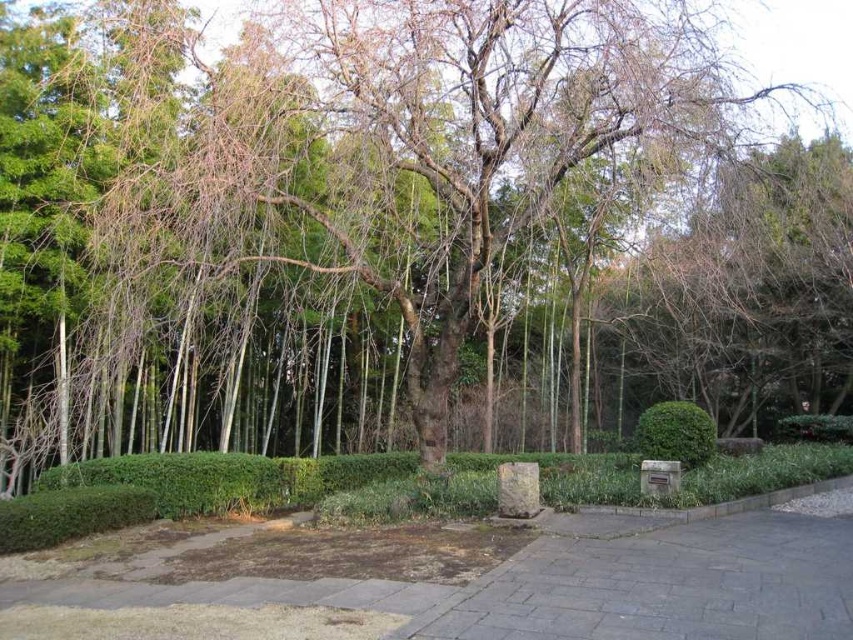
Based on the photo, you are a gardener planning to plant a new flower bed between the gray stone pavement at lower center and the green matte bush at center. Which object is shorter so that the flowers can grow taller than both?

The gray stone pavement at lower center has a lesser height compared to the green matte bush at center, so the flowers should be planted where they can grow taller than both the gray stone pavement at lower center and the green matte bush at center.

You are standing on the gray stone pavement at lower center and want to reach the green matte bush at center. Which direction should you move to get there?

You should move upward to reach the green matte bush at center because the gray stone pavement at lower center is below it.

You are planning to place a small garden statue that requires a 2x2 meter space. You have two options for placement in the scene described. The first option is on the gray stone pavement at lower center, and the second option is on the green matte bush at center. Based on the size of these areas, which location would be more suitable for placing the statue?

The green matte bush at center is larger in size compared to the gray stone pavement at lower center, so placing the statue on the green matte bush at center would be more suitable as it provides enough space for the 2x2 meter requirement.